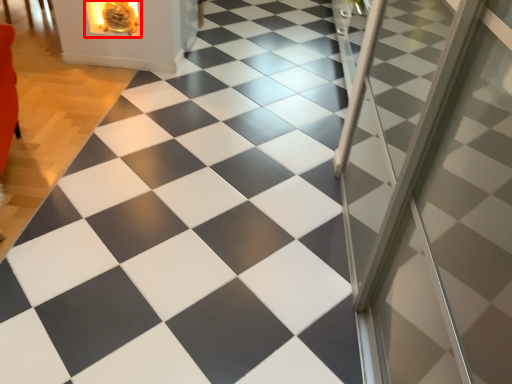
Question: From the image's perspective, where is fireplace (annotated by the red box) located in relation to screen door in the image?

Choices:
 (A) below
 (B) above

Answer: (B)